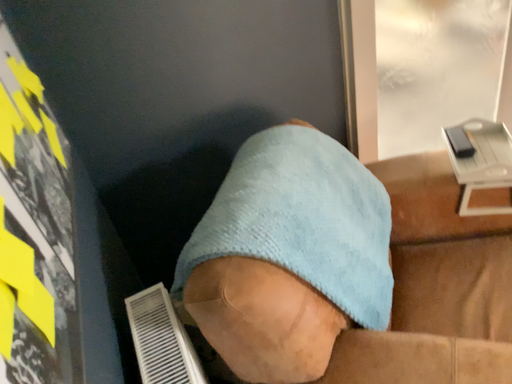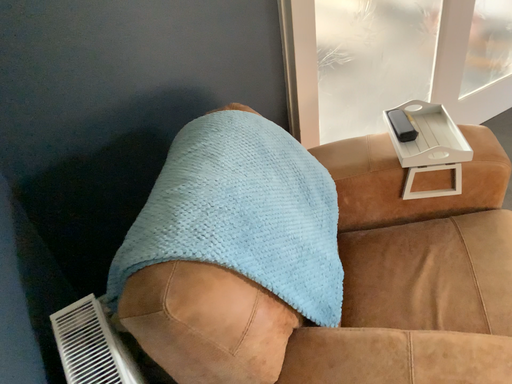
Question: Which way did the camera rotate in the video?

Choices:
 (A) rotated right
 (B) rotated left

Answer: (A)